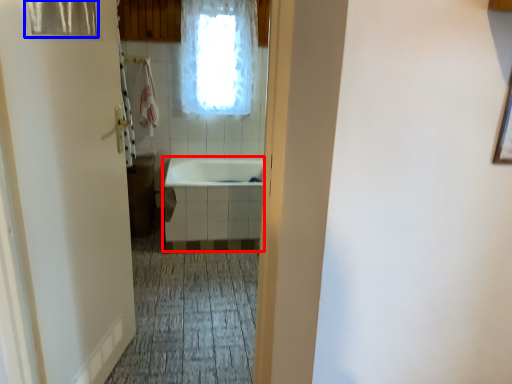
Question: Which object is closer to the camera taking this photo, bath (highlighted by a red box) or shower curtain (highlighted by a blue box)?

Choices:
 (A) bath
 (B) shower curtain

Answer: (B)